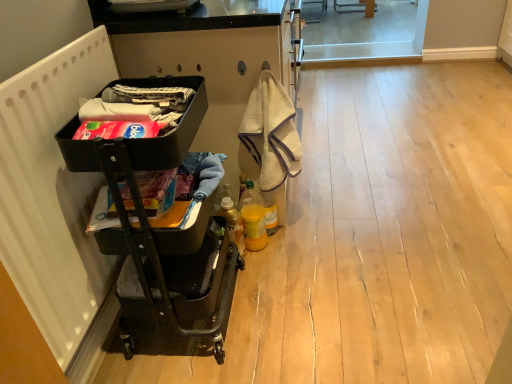
The height and width of the screenshot is (384, 512). I want to click on free space to the right of translucent plastic bottle at lower center, which is the 1th bottle from left to right, so pyautogui.click(x=284, y=252).